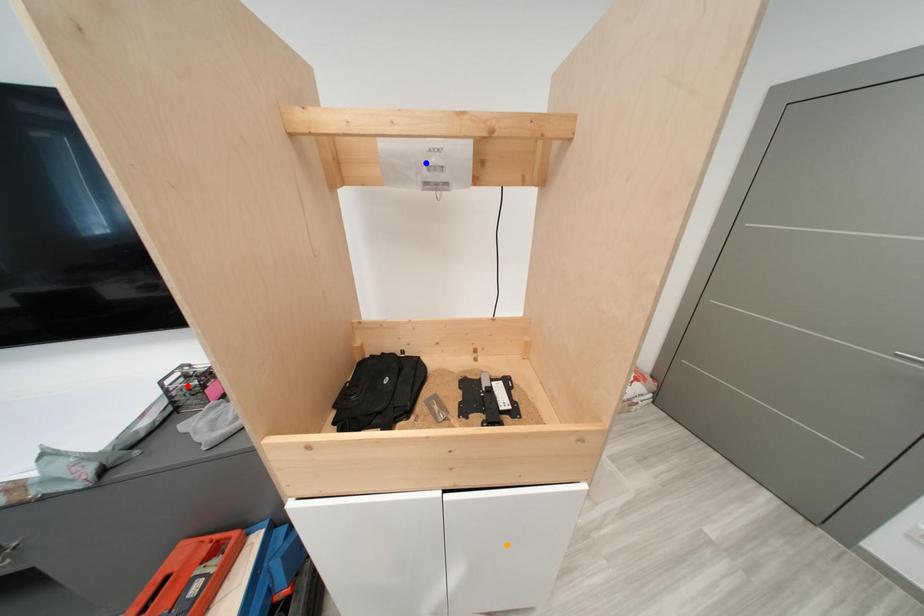
Order these from nearest to farthest:
1. orange point
2. blue point
3. red point

orange point
blue point
red point